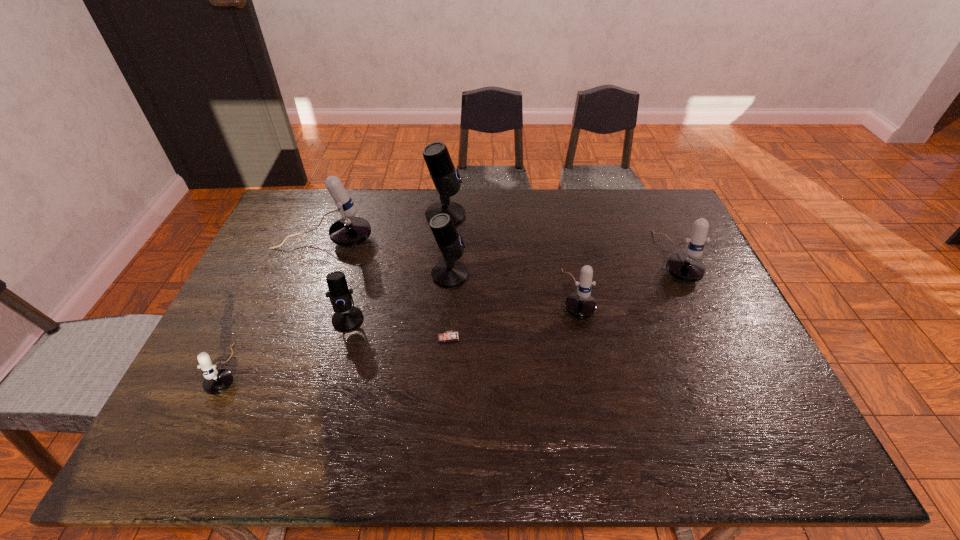
The height and width of the screenshot is (540, 960). In order to click on the nearest object in this screenshot , I will do `click(216, 381)`.

This screenshot has height=540, width=960. I want to click on the nearest microphone, so click(216, 381).

Image resolution: width=960 pixels, height=540 pixels. In order to click on the shortest object in this screenshot , I will do `click(449, 335)`.

Identify the location of the second nearest object. (449, 335).

Image resolution: width=960 pixels, height=540 pixels. What are the coordinates of `vacant point located 0.230m on the stand of the farthest object` in the screenshot? It's located at (531, 215).

In order to click on vacant space located 0.130m on the front of the biggest white microphone in this screenshot , I will do `click(307, 284)`.

In order to click on vacant space located 0.090m on the stand of the second farthest black microphone in this screenshot , I will do `click(498, 274)`.

Identify the location of vacant space located on the left of the second biggest white microphone. (637, 258).

The height and width of the screenshot is (540, 960). Find the location of `vacant space located 0.130m on the back of the second microphone from right to left`. vacant space located 0.130m on the back of the second microphone from right to left is located at coordinates (564, 241).

Locate an element on the screen. This screenshot has width=960, height=540. blank space located on the stand of the smallest black microphone is located at coordinates (329, 387).